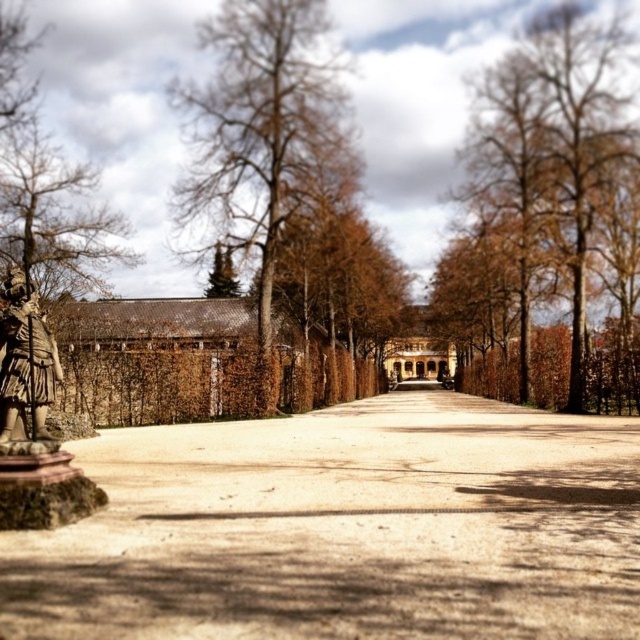
Question: Does brown gravel driveway at center come in front of brown textured tree at center?

Choices:
 (A) yes
 (B) no

Answer: (A)

Question: Which point is closer to the camera?

Choices:
 (A) (81, 592)
 (B) (344, 134)

Answer: (A)

Question: Can you confirm if brown textured tree at center is bigger than bronze statue at left?

Choices:
 (A) no
 (B) yes

Answer: (B)

Question: Which of the following is the farthest from the observer?

Choices:
 (A) brown textured wall at center
 (B) brown gravel driveway at center
 (C) brown textured tree at center
 (D) bronze statue at left

Answer: (A)

Question: Can you confirm if brown textured wall at center is positioned above bronze statue at left?

Choices:
 (A) no
 (B) yes

Answer: (B)

Question: Among these objects, which one is farthest from the camera?

Choices:
 (A) bronze statue at left
 (B) brown gravel driveway at center
 (C) brown textured wall at center
 (D) brown textured tree at center

Answer: (C)